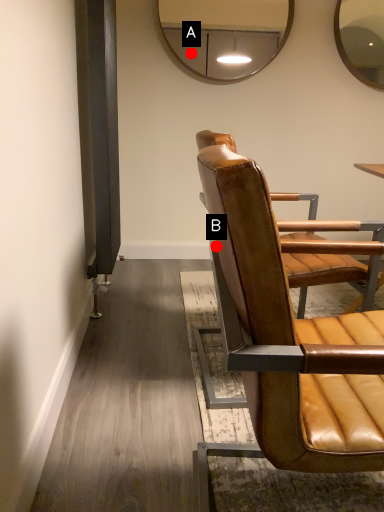
Question: Two points are circled on the image, labeled by A and B beside each circle. Which point is closer to the camera taking this photo?

Choices:
 (A) A is closer
 (B) B is closer

Answer: (B)